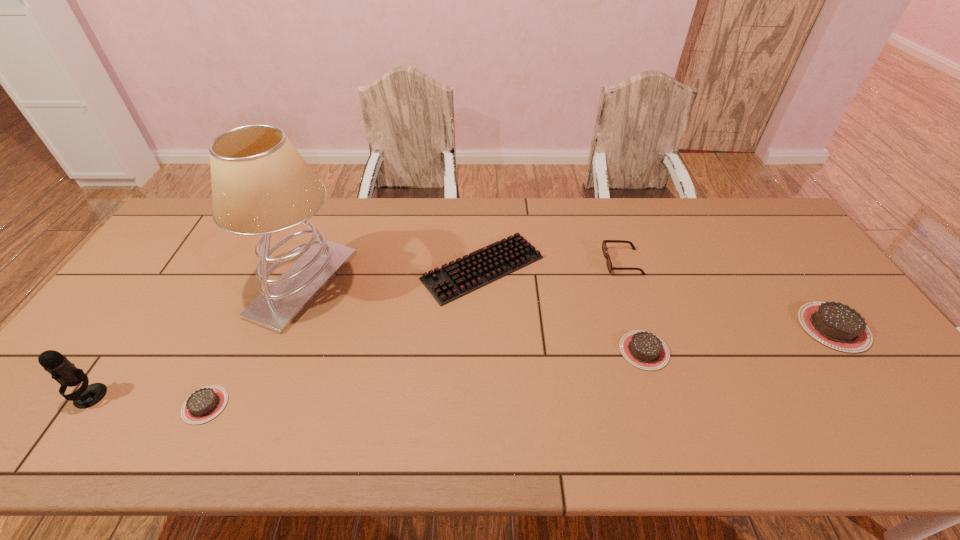
Please point a space for a new chocolate_cake to maintain equal intervals. Please provide its 2D coordinates. Your answer should be formatted as a tuple, i.e. [(x, y)], where the tuple contains the x and y coordinates of a point satisfying the conditions above.

[(436, 376)]